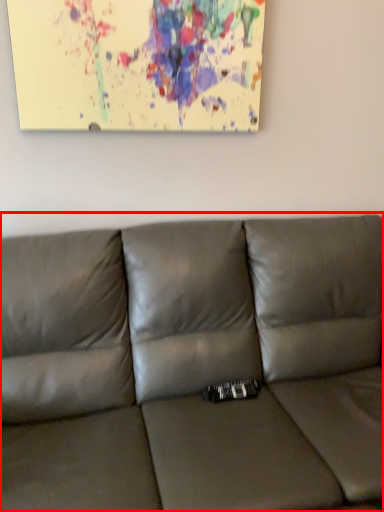
Question: From the image's perspective, what is the correct spatial relationship of studio couch (annotated by the red box) in relation to picture frame?

Choices:
 (A) above
 (B) below

Answer: (B)